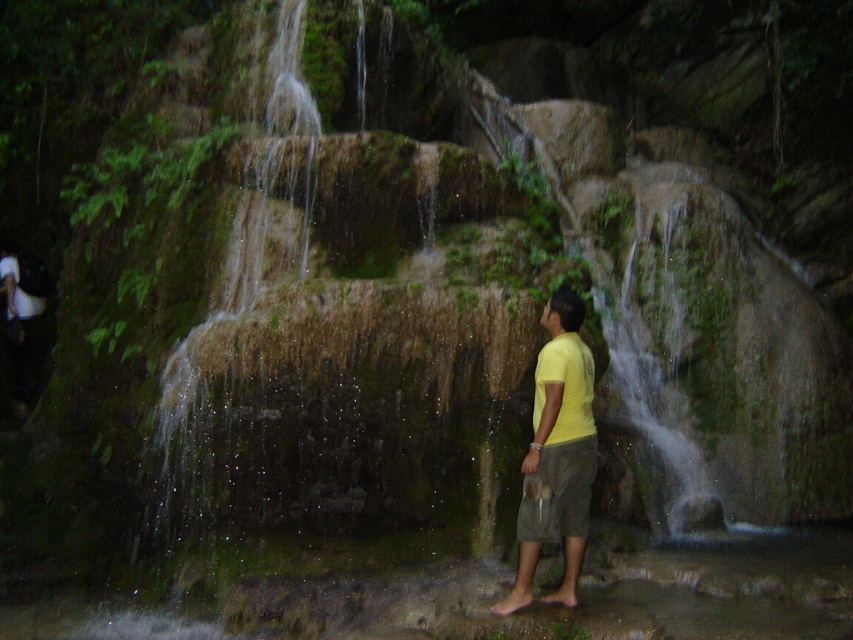
You are a photographer trying to capture the person in the scene. Since the yellow matte shirt at center and gray cotton shorts at center are both at the center, which one would you focus on to ensure the entire person is in frame?

The yellow matte shirt at center might be wider than gray cotton shorts at center, so focusing on the yellow matte shirt at center would ensure the entire person is captured in the frame.

You are a hiker who wants to take a photo of the waterfall. You are standing at the base of the waterfall where the yellow matte shirt at center is located. To avoid getting your camera wet, which direction should you face? The options are left, right, forward, or backward.

You should face backward to avoid getting your camera wet because the yellow matte shirt at center is located at the base of the waterfall, and facing backward would move you away from the falling water.